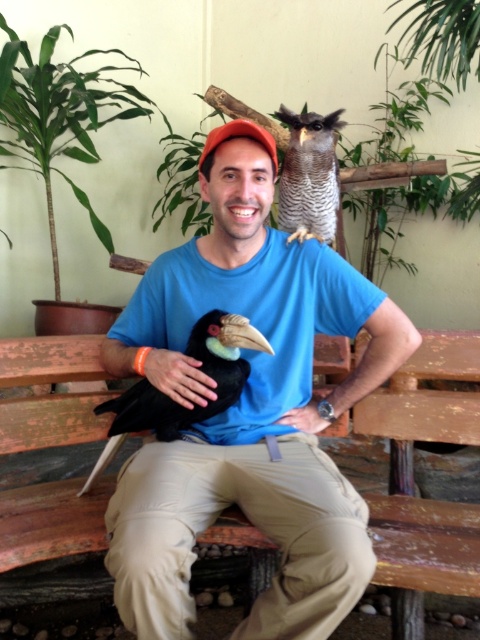
Question: Can you confirm if brown wooden bench at center is bigger than matte blue shirt at center?

Choices:
 (A) no
 (B) yes

Answer: (B)

Question: Can you confirm if blue cotton shirt at center is positioned to the right of matte black hand at center?

Choices:
 (A) yes
 (B) no

Answer: (A)

Question: Which point is farther from the camera taking this photo?

Choices:
 (A) (393, 577)
 (B) (317, 216)

Answer: (B)

Question: Estimate the real-world distances between objects in this image. Which object is farther from the matte black hand at center?

Choices:
 (A) blue cotton shirt at center
 (B) brown wooden bench at center
 (C) gray striped owl at upper center

Answer: (C)

Question: Which point appears farthest from the camera in this image?

Choices:
 (A) (398, 474)
 (B) (312, 426)
 (C) (282, 522)

Answer: (A)

Question: Can you confirm if blue cotton shirt at center is bigger than matte blue shirt at center?

Choices:
 (A) no
 (B) yes

Answer: (B)